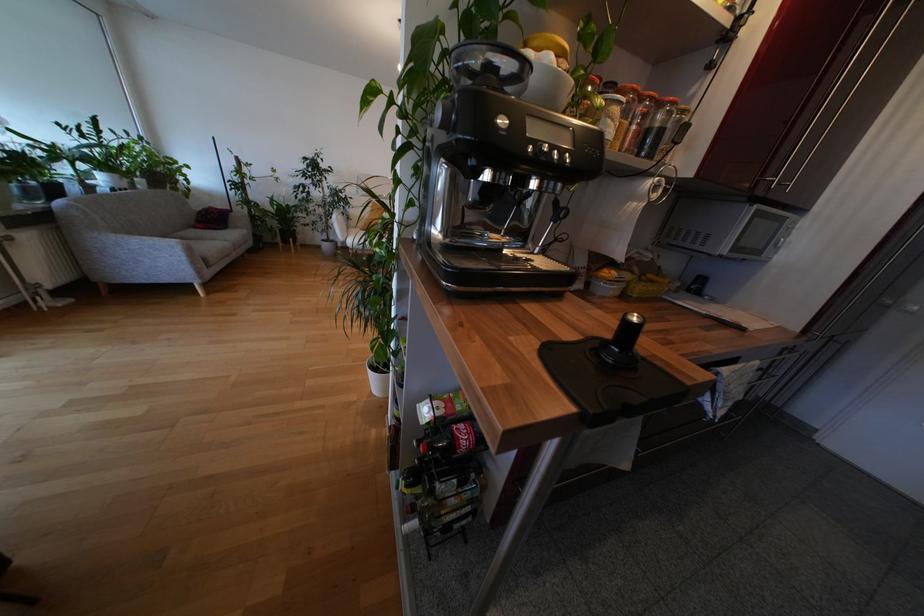
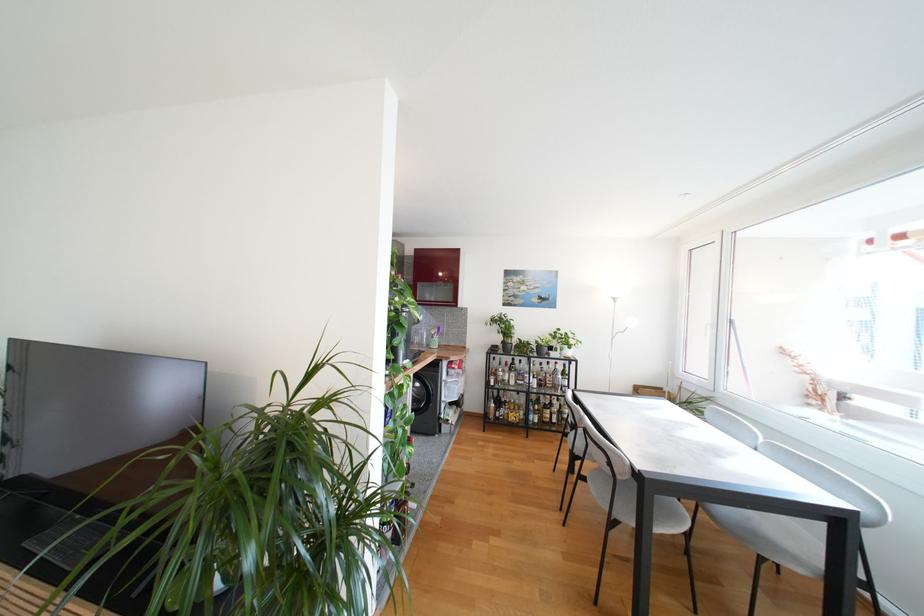
Question: I am providing you with two images of the same scene from different viewpoints. Please identify which objects are invisible in image2.

Choices:
 (A) glass bottle
 (B) utensil holder
 (C) orange jar lid
 (D) utility knife slider

Answer: (C)